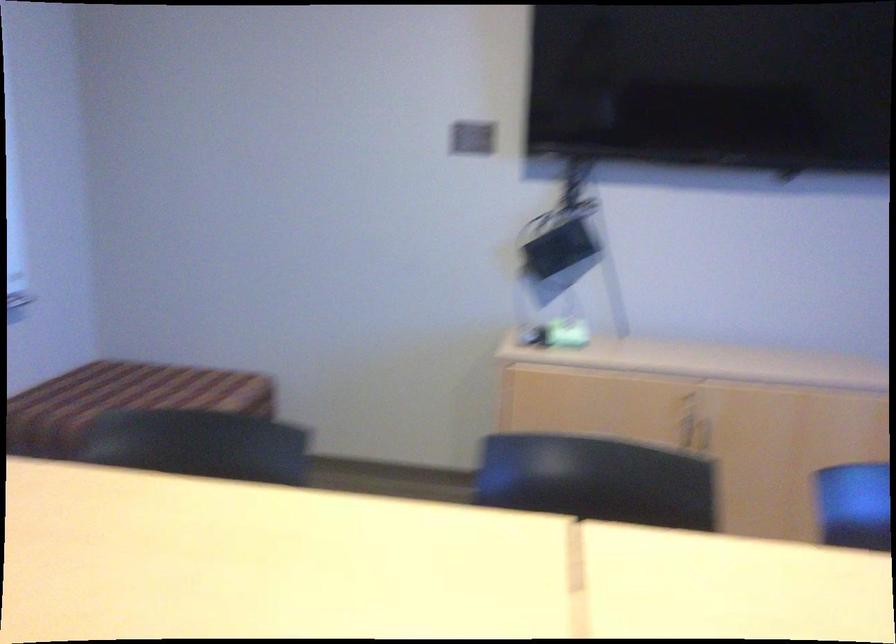
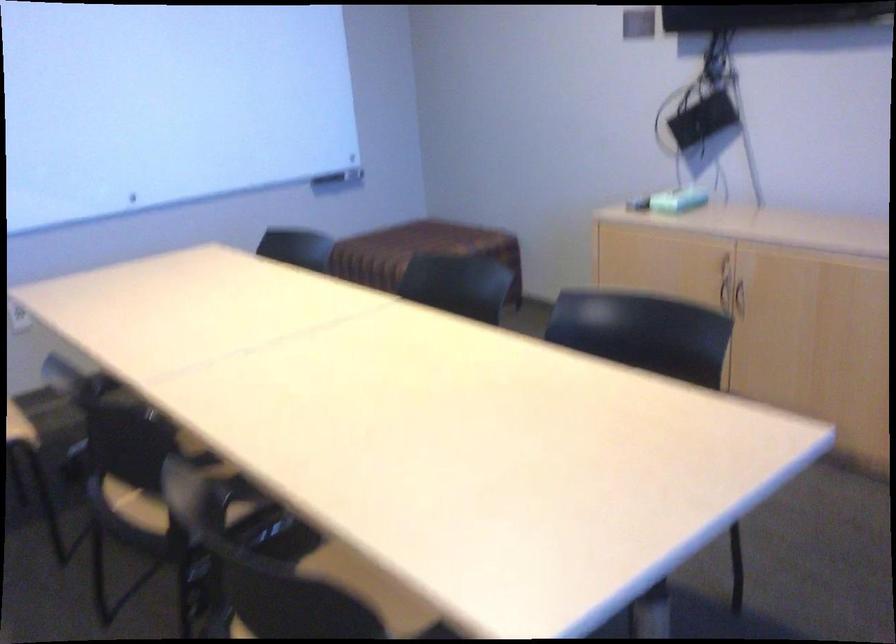
In the second image, find the point that corresponds to the point at 685,440 in the first image.

(738, 299)